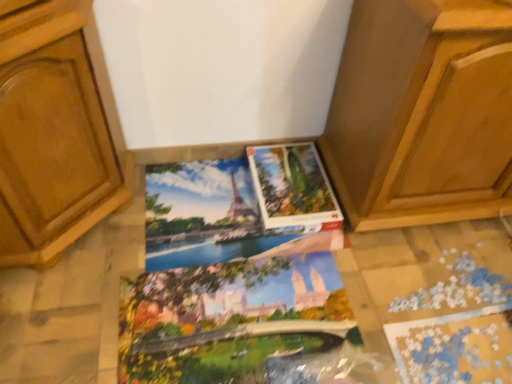
Identify the location of unoccupied region to the right of matte paper coloring book at center, placed as the first coloring book when sorted from top to bottom. (397, 282).